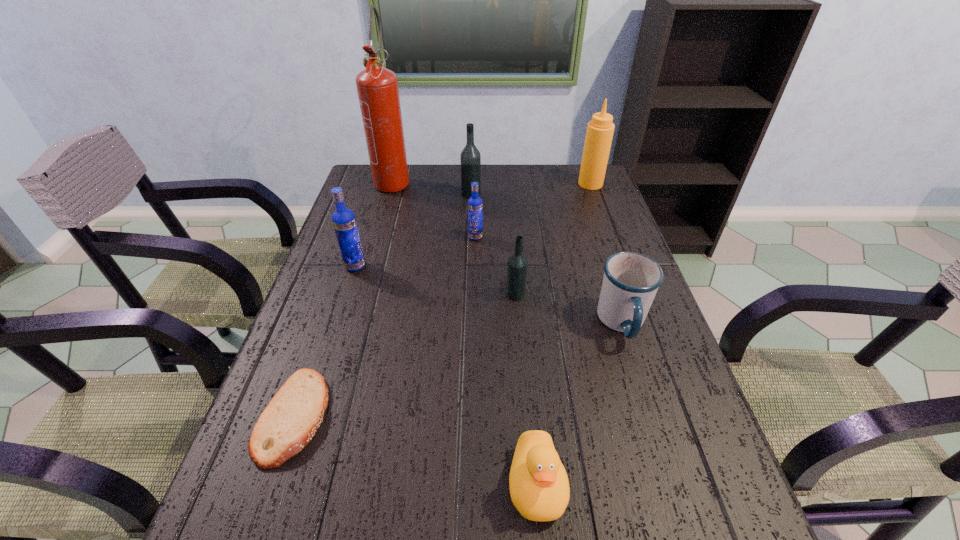
Where is `fire extinguisher`? Image resolution: width=960 pixels, height=540 pixels. fire extinguisher is located at coordinates (377, 87).

I want to click on red fire extinguisher, so click(377, 87).

Where is `tan condiment`? tan condiment is located at coordinates (599, 134).

You are a GUI agent. You are given a task and a screenshot of the screen. Output one action in this format:
    pyautogui.click(x=<x>, y=<y>)
    Task: Click on the eighth shortest object
    This screenshot has width=960, height=540.
    Given the screenshot: What is the action you would take?
    pyautogui.click(x=599, y=134)

This screenshot has height=540, width=960. In order to click on the leftmost vodka in this screenshot , I will do tap(344, 222).

Locate an element on the screen. The width and height of the screenshot is (960, 540). the fifth farthest object is located at coordinates (344, 222).

Locate an element on the screen. the left black vodka is located at coordinates (470, 158).

Locate an element on the screen. the farthest vodka is located at coordinates (x=470, y=158).

The height and width of the screenshot is (540, 960). I want to click on the fourth farthest object, so pos(475,204).

Locate an element on the screen. The image size is (960, 540). the right blue vodka is located at coordinates (475, 204).